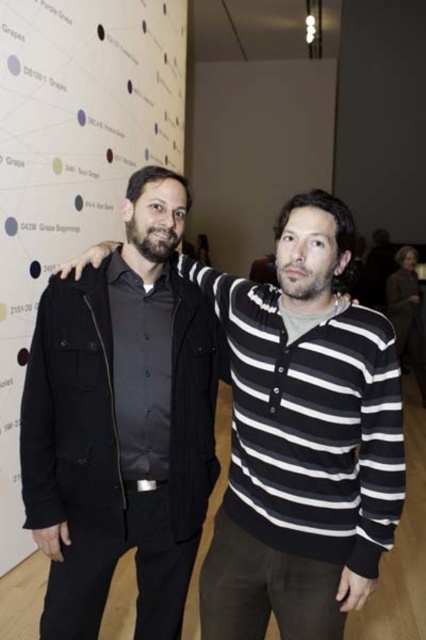
You are standing 10 feet away from the wall with the map or diagram in the background. You want to touch the point labeled as point (227,300) on the wall. Can you reach it without moving closer?

The point (227,300) is 5.64 feet away from you. Since you are 10 feet away from the wall, you cannot reach it without moving closer.

You are standing in the same room as the two people in the image. You want to walk from the point labeled as point (x=319, y=336) to the point labeled as point (x=13, y=376). Which direction should you move in to get there?

To move from point (x=319, y=336) to point (x=13, y=376), you should move downward and slightly to the right since point (x=13, y=376) is below and to the right of point (x=319, y=336).